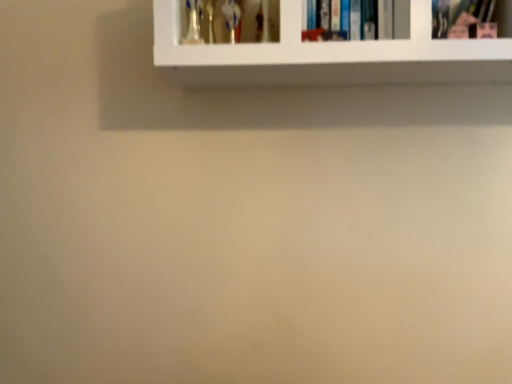
Question: Can white glossy shelf at upper center be found inside pink matte book at upper right, the 1th book in the front-to-back sequence?

Choices:
 (A) yes
 (B) no

Answer: (B)

Question: Considering the relative sizes of pink matte book at upper right, placed as the second book when sorted from back to front, and white glossy shelf at upper center in the image provided, is pink matte book at upper right, placed as the second book when sorted from back to front, smaller than white glossy shelf at upper center?

Choices:
 (A) yes
 (B) no

Answer: (A)

Question: Is there a large distance between pink matte book at upper right, the 1th book in the front-to-back sequence, and white glossy shelf at upper center?

Choices:
 (A) no
 (B) yes

Answer: (A)

Question: Considering the relative positions of pink matte book at upper right, the second book from the left, and white glossy shelf at upper center in the image provided, is pink matte book at upper right, the second book from the left, behind white glossy shelf at upper center?

Choices:
 (A) no
 (B) yes

Answer: (B)

Question: Is pink matte book at upper right, the second book from the left, next to white glossy shelf at upper center?

Choices:
 (A) no
 (B) yes

Answer: (A)

Question: Is pink matte book at upper right, the 1th book in the front-to-back sequence, completely or partially outside of white glossy shelf at upper center?

Choices:
 (A) yes
 (B) no

Answer: (B)

Question: From a real-world perspective, is hardcover book at upper center, placed as the 2th book when sorted from right to left, beneath white glossy shelf at upper center?

Choices:
 (A) no
 (B) yes

Answer: (A)

Question: Does hardcover book at upper center, the first book in the back-to-front sequence, turn towards white glossy shelf at upper center?

Choices:
 (A) yes
 (B) no

Answer: (A)

Question: Is hardcover book at upper center, the first book in the back-to-front sequence, to the right of white glossy shelf at upper center from the viewer's perspective?

Choices:
 (A) yes
 (B) no

Answer: (B)

Question: Is hardcover book at upper center, acting as the first book starting from the left, placed right next to white glossy shelf at upper center?

Choices:
 (A) no
 (B) yes

Answer: (A)

Question: From the image's perspective, is hardcover book at upper center, placed as the 2th book when sorted from right to left, on top of white glossy shelf at upper center?

Choices:
 (A) no
 (B) yes

Answer: (B)

Question: Considering the relative sizes of hardcover book at upper center, arranged as the 2th book when viewed from the front, and white glossy shelf at upper center in the image provided, is hardcover book at upper center, arranged as the 2th book when viewed from the front, bigger than white glossy shelf at upper center?

Choices:
 (A) yes
 (B) no

Answer: (B)

Question: Is white glossy shelf at upper center thinner than hardcover book at upper center, placed as the 2th book when sorted from right to left?

Choices:
 (A) no
 (B) yes

Answer: (A)